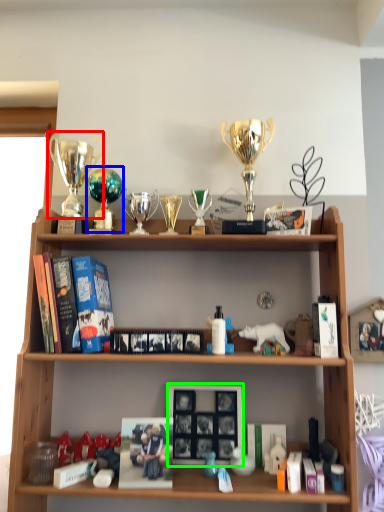
Question: Estimate the real-world distances between objects in this image. Which object is closer to trophy (highlighted by a red box), trophy (highlighted by a blue box) or picture frame (highlighted by a green box)?

Choices:
 (A) trophy
 (B) picture frame

Answer: (A)